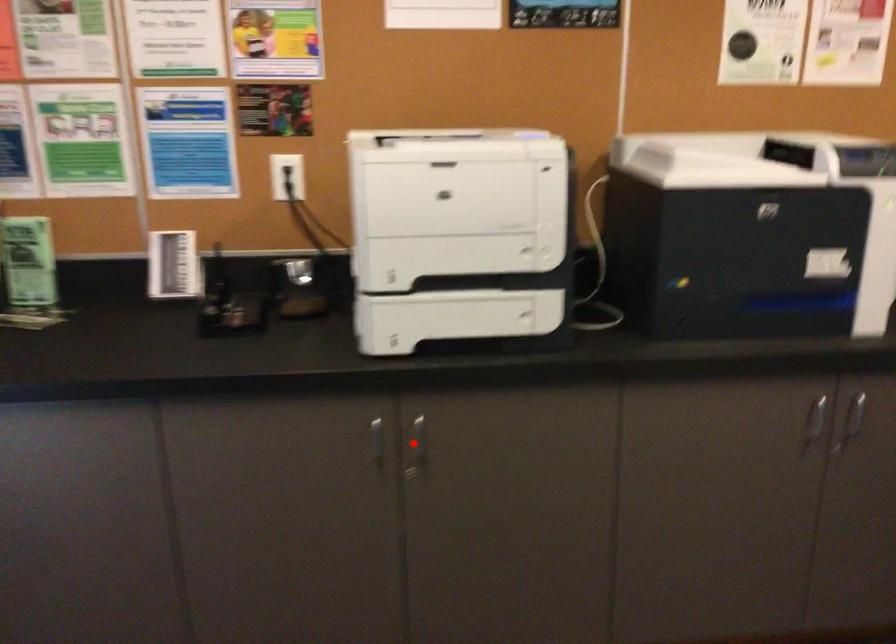
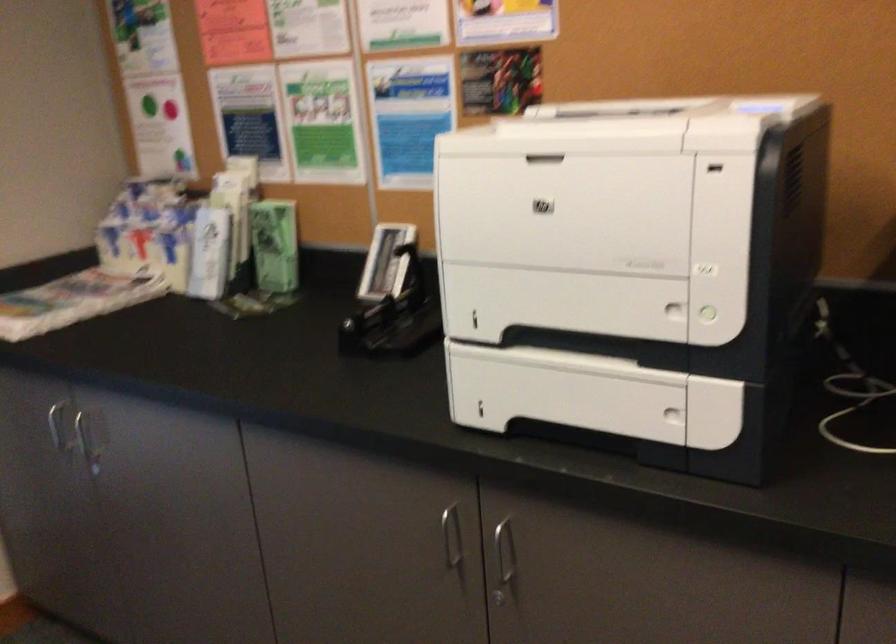
Locate, in the second image, the point that corresponds to the highlighted location in the first image.

(504, 559)